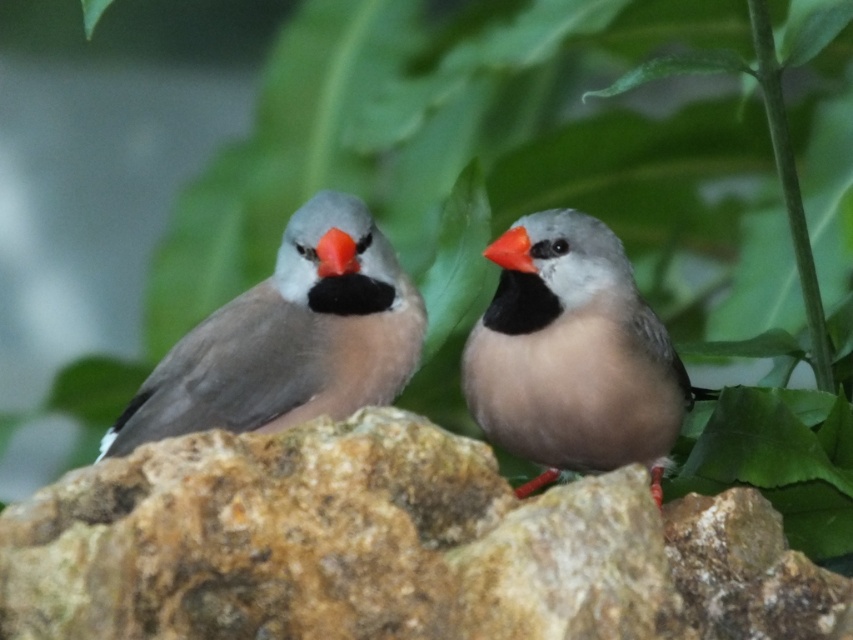
Question: Which of the following is the farthest from the observer?

Choices:
 (A) (383, 301)
 (B) (711, 522)
 (C) (537, 410)

Answer: (A)

Question: Can you confirm if gray matte bird at left is thinner than orange matte beak at center?

Choices:
 (A) no
 (B) yes

Answer: (A)

Question: Does matte gray bird at center appear on the right side of matte orange beak at left?

Choices:
 (A) yes
 (B) no

Answer: (A)

Question: Does matte gray bird at center appear under orange matte beak at center?

Choices:
 (A) no
 (B) yes

Answer: (B)

Question: Which object is the closest to the orange matte beak at center?

Choices:
 (A) matte gray bird at center
 (B) brown rough rock at center
 (C) matte orange beak at left

Answer: (A)

Question: Which of the following is the closest to the observer?

Choices:
 (A) gray matte bird at left
 (B) matte gray bird at center
 (C) matte orange beak at left

Answer: (A)